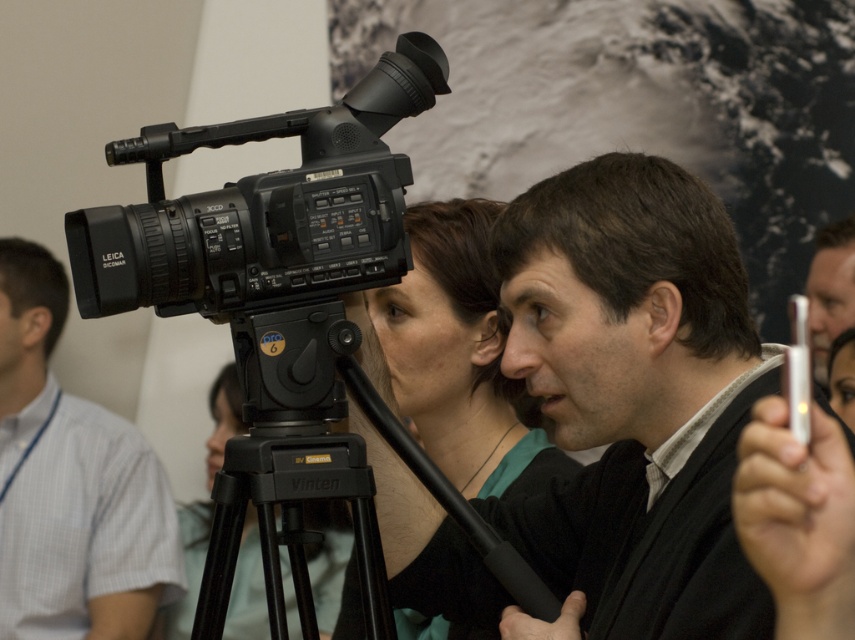
You are setting up a photography studio and need to place two tripods in a narrow space. The black plastic tripod at center and the matte black tripod at center are both options. Based on their size, which tripod would be better suited for the narrow space?

The black plastic tripod at center occupies less space than the matte black tripod at center, so it would be better suited for the narrow space.

You are standing in front of the video camera setup and see two points marked in the image. Which point, point (245,246) or point (255,534), is closer to the camera?

Point (245,246) is closer to the camera than point (255,534).

You are a photographer setting up equipment for an outdoor shoot. You have a matte black camera at left and a black plastic tripod at center. Based on the scene description, which object is positioned behind the other?

The black plastic tripod at center is behind the matte black camera at left according to the description.